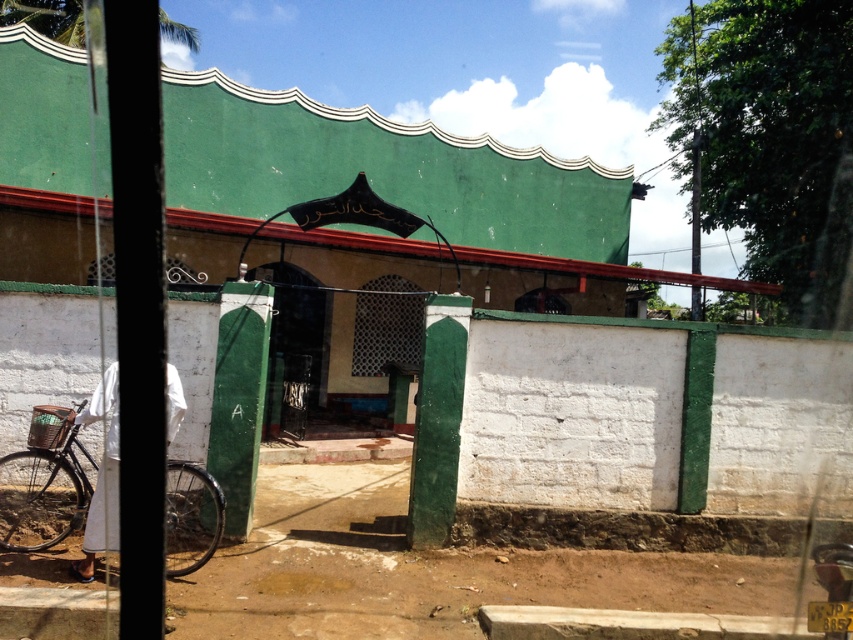
Question: Can you confirm if brown dirt track at lower left is positioned above black matte bicycle at left?

Choices:
 (A) no
 (B) yes

Answer: (A)

Question: Which object is farther from the camera taking this photo?

Choices:
 (A) black matte bicycle at left
 (B) brown dirt track at lower left

Answer: (A)

Question: Is brown dirt track at lower left above black matte bicycle at left?

Choices:
 (A) yes
 (B) no

Answer: (B)

Question: Which of the following is the farthest from the observer?

Choices:
 (A) (173, 506)
 (B) (310, 627)

Answer: (A)

Question: Does brown dirt track at lower left lie behind black matte bicycle at left?

Choices:
 (A) no
 (B) yes

Answer: (A)

Question: Which of the following is the closest to the observer?

Choices:
 (A) black matte bicycle at left
 (B) brown dirt track at lower left

Answer: (B)